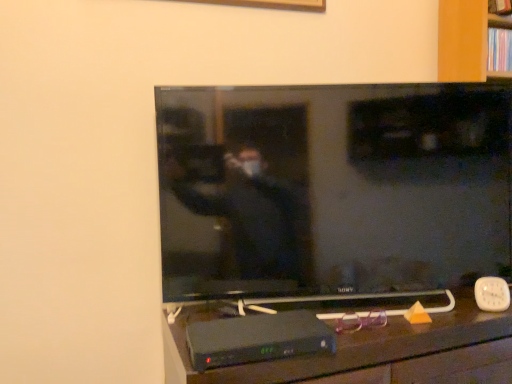
Question: Is the surface of black plastic tv stand at lower center in direct contact with wooden bookshelf at upper right?

Choices:
 (A) no
 (B) yes

Answer: (A)

Question: Would you say black plastic tv stand at lower center is outside wooden bookshelf at upper right?

Choices:
 (A) yes
 (B) no

Answer: (A)

Question: Is black plastic tv stand at lower center looking in the opposite direction of wooden bookshelf at upper right?

Choices:
 (A) no
 (B) yes

Answer: (A)

Question: Is black plastic tv stand at lower center at the right side of wooden bookshelf at upper right?

Choices:
 (A) no
 (B) yes

Answer: (A)

Question: Is black plastic tv stand at lower center bigger than wooden bookshelf at upper right?

Choices:
 (A) no
 (B) yes

Answer: (B)

Question: Is wooden bookshelf at upper right taller or shorter than flat screen tv at center?

Choices:
 (A) short
 (B) tall

Answer: (A)

Question: From a real-world perspective, is wooden bookshelf at upper right positioned above or below flat screen tv at center?

Choices:
 (A) above
 (B) below

Answer: (A)

Question: From the image's perspective, is wooden bookshelf at upper right positioned above or below flat screen tv at center?

Choices:
 (A) above
 (B) below

Answer: (A)

Question: Considering their positions, is wooden bookshelf at upper right located in front of or behind flat screen tv at center?

Choices:
 (A) front
 (B) behind

Answer: (B)

Question: Choose the correct answer: Is wooden bookshelf at upper right inside black plastic tv stand at lower center or outside it?

Choices:
 (A) inside
 (B) outside

Answer: (B)

Question: In terms of width, does wooden bookshelf at upper right look wider or thinner when compared to black plastic tv stand at lower center?

Choices:
 (A) thin
 (B) wide

Answer: (A)

Question: Relative to black plastic tv stand at lower center, is wooden bookshelf at upper right in front or behind?

Choices:
 (A) front
 (B) behind

Answer: (B)

Question: From the image's perspective, relative to black plastic tv stand at lower center, is wooden bookshelf at upper right above or below?

Choices:
 (A) above
 (B) below

Answer: (A)

Question: Is flat screen tv at center to the left or to the right of black plastic tv stand at lower center in the image?

Choices:
 (A) left
 (B) right

Answer: (A)

Question: From a real-world perspective, relative to black plastic tv stand at lower center, is flat screen tv at center vertically above or below?

Choices:
 (A) below
 (B) above

Answer: (B)